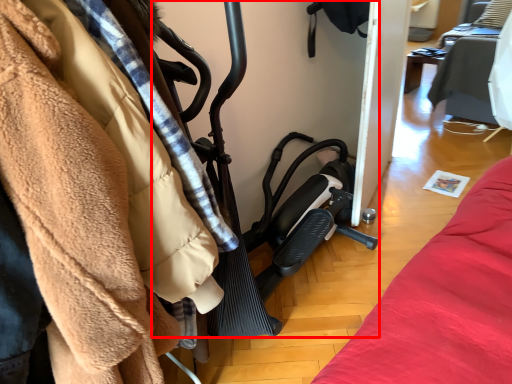
Question: From the image's perspective, what is the correct spatial relationship of baby carriage (annotated by the red box) in relation to furniture?

Choices:
 (A) below
 (B) above

Answer: (A)